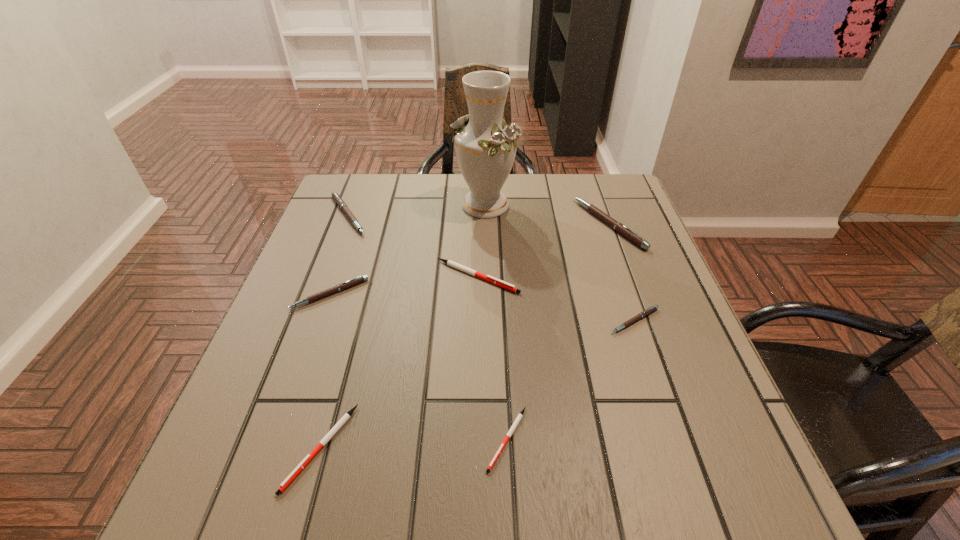
The image size is (960, 540). Identify the location of object present at the far left corner. (336, 197).

Identify the location of object present at the near left corner. The height and width of the screenshot is (540, 960). point(342,421).

Locate an element on the screen. The width and height of the screenshot is (960, 540). object at the far right corner is located at coordinates (617, 226).

In the image, there is a desktop. Identify the location of vacant area at the far edge. (514, 200).

This screenshot has width=960, height=540. Identify the location of vacant point at the near edge. (465, 497).

I want to click on vacant area at the left edge of the desktop, so click(x=300, y=261).

Locate an element on the screen. Image resolution: width=960 pixels, height=540 pixels. vacant space at the right edge of the desktop is located at coordinates (669, 357).

At what (x,y) coordinates should I click in order to perform the action: click on vacant space at the near left corner. Please return your answer as a coordinate pair (x, y). This screenshot has width=960, height=540. Looking at the image, I should click on (275, 497).

Find the location of `free space at the far right corner`. free space at the far right corner is located at coordinates (587, 215).

This screenshot has width=960, height=540. In the image, there is a desktop. In order to click on vacant space at the near right corner in this screenshot , I will do `click(718, 463)`.